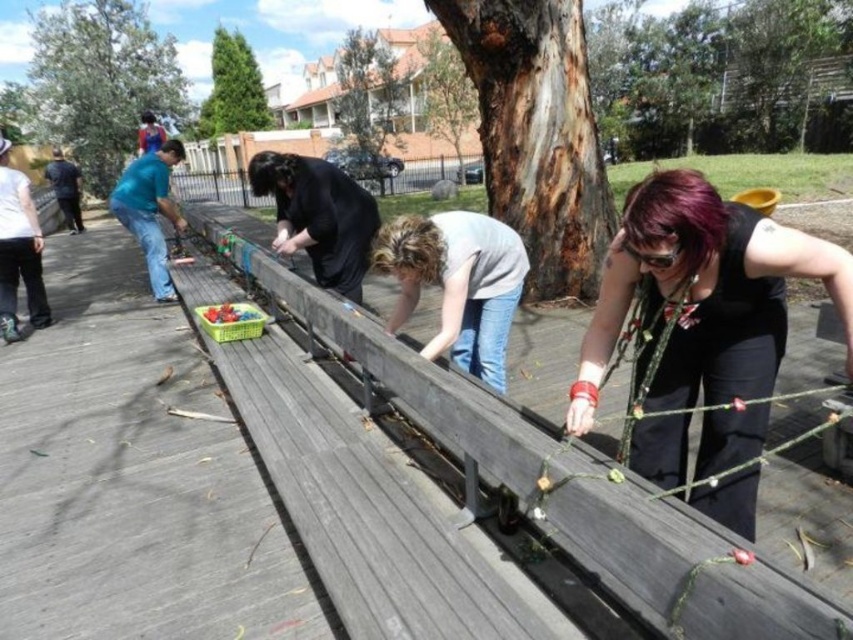
You are a photographer trying to capture a closeup of the black matte shirt at center and the jeans at left. Which item should you zoom in on more to ensure both are in focus?

The black matte shirt at center is smaller than the jeans at left, so you should zoom in more on the black matte shirt at center to ensure both are in focus.

You are a photographer trying to capture the scene of the group working on the wooden bridge. You notice the black matte shirt at center and the jeans at left. Which clothing item is located more to the right side of the scene?

The black matte shirt at center is positioned on the right side of jeans at left, so the black matte shirt at center is more to the right.